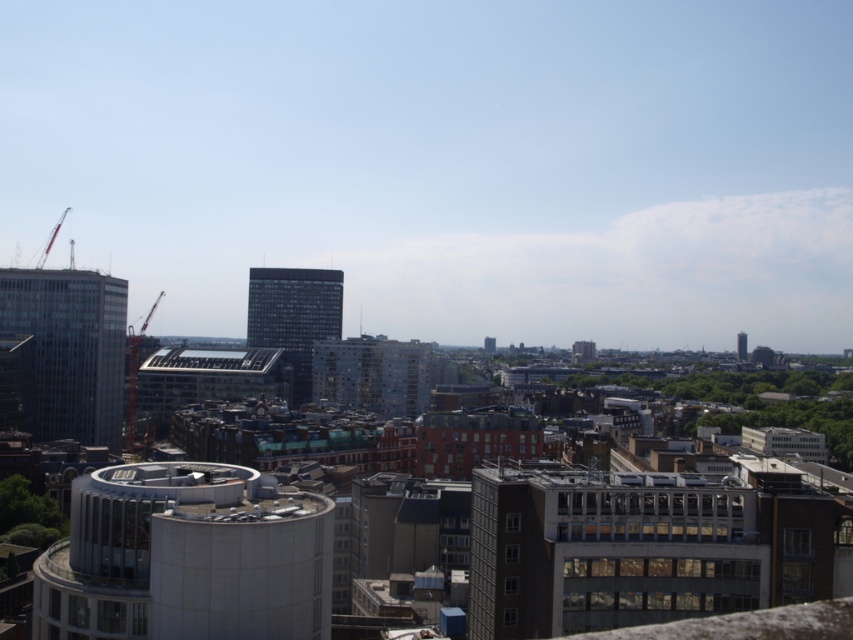
Question: Is white smooth tower at lower left bigger than glassy reflective skyscraper at left?

Choices:
 (A) no
 (B) yes

Answer: (A)

Question: Among these objects, which one is nearest to the camera?

Choices:
 (A) white smooth tower at lower left
 (B) red metallic crane at left
 (C) glassy reflective skyscraper at left
 (D) light brown glass building at center

Answer: (A)

Question: Is light brown glass building at center positioned before smooth glass tower at right?

Choices:
 (A) yes
 (B) no

Answer: (A)

Question: Which object appears farthest from the camera in this image?

Choices:
 (A) white smooth tower at lower left
 (B) smooth glass tower at right
 (C) dark glass building at center
 (D) metallic construction crane at left

Answer: (B)

Question: Is white smooth tower at lower left further to camera compared to smooth glass tower at right?

Choices:
 (A) no
 (B) yes

Answer: (A)

Question: Which point is farther to the camera?

Choices:
 (A) smooth glass tower at right
 (B) metallic construction crane at left
 (C) light brown glass building at center
 (D) glassy reflective skyscraper at left

Answer: (A)